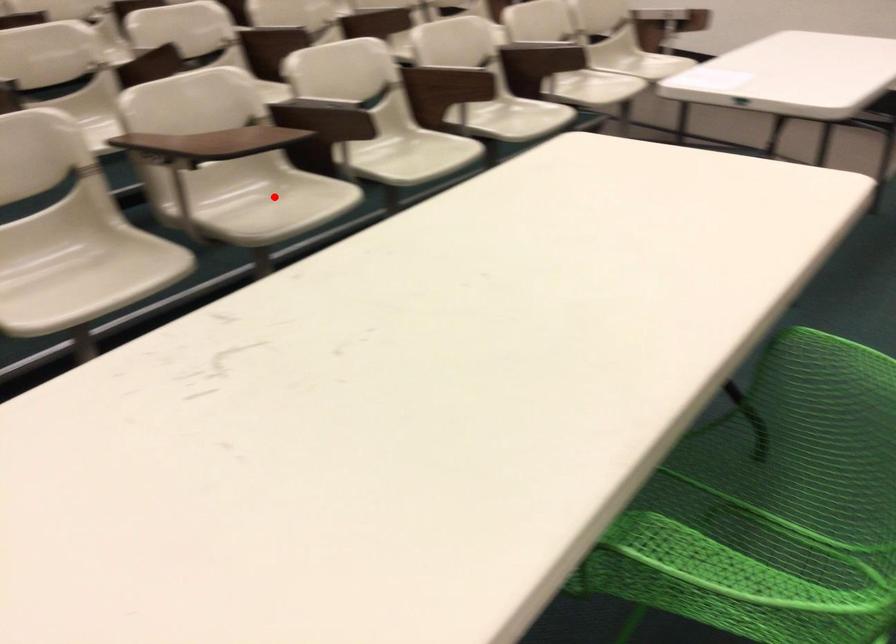
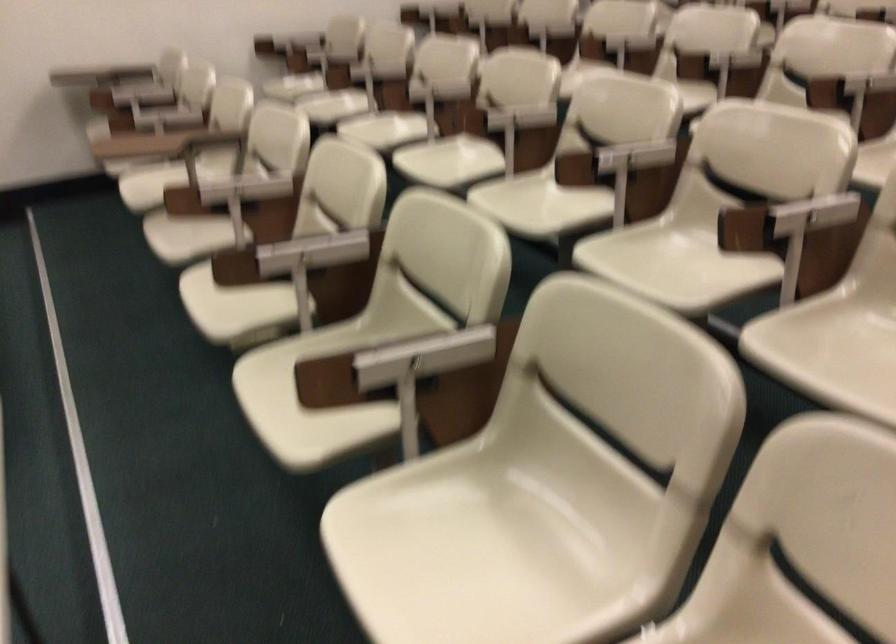
Question: I am providing you with two images of the same scene from different viewpoints. A red point is marked on the first image. Is the red point's position out of view in image 2?

Choices:
 (A) Yes
 (B) No

Answer: (A)